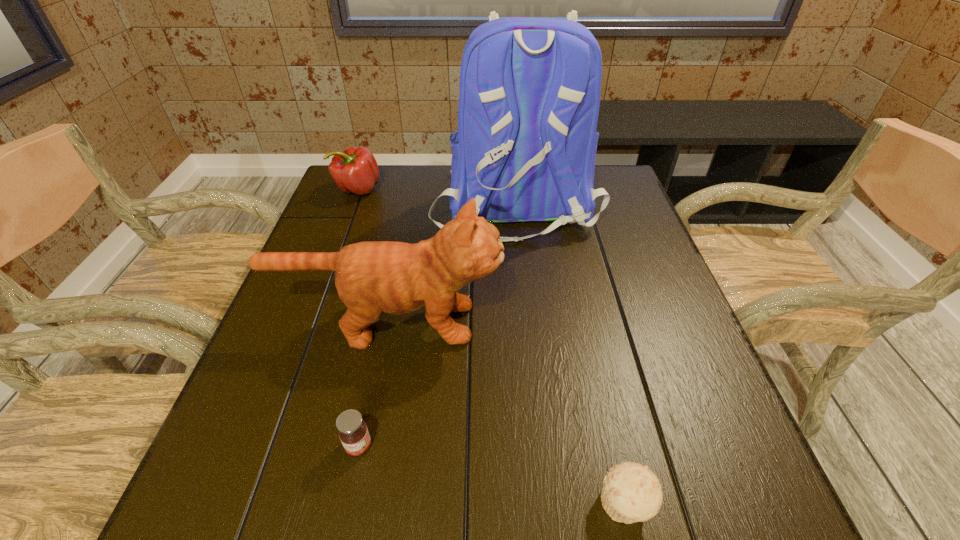
Locate an element on the screen. The image size is (960, 540). free space between the second tallest object and the jam is located at coordinates (373, 384).

Identify which object is the closest to the backpack. Please provide its 2D coordinates. Your answer should be formatted as a tuple, i.e. [(x, y)], where the tuple contains the x and y coordinates of a point satisfying the conditions above.

[(372, 277)]

Find the location of a particular element. This screenshot has width=960, height=540. object that ranks as the closest to the tallest object is located at coordinates (372, 277).

This screenshot has height=540, width=960. In order to click on blank space that satisfies the following two spatial constraints: 1. on the face of the third farthest object; 2. on the label side of the jam in this screenshot , I will do `click(365, 446)`.

Locate an element on the screen. The width and height of the screenshot is (960, 540). free point that satisfies the following two spatial constraints: 1. on the back of the backpack; 2. on the face of the second tallest object is located at coordinates tap(525, 323).

I want to click on free space that satisfies the following two spatial constraints: 1. on the label side of the fourth farthest object; 2. on the left side of the nearest object, so click(x=347, y=504).